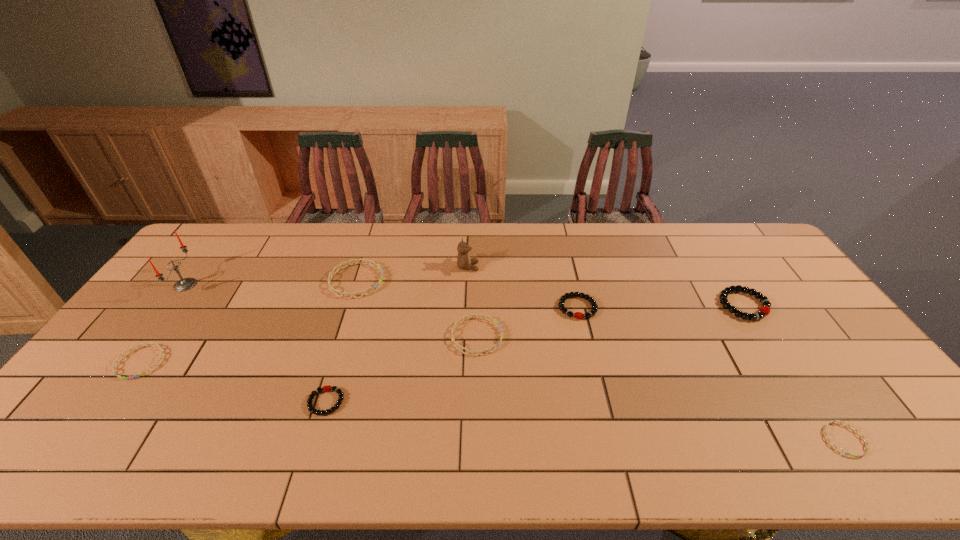
At what (x,y) coordinates should I click in order to perform the action: click on vacant space located on the left of the biggest black bracelet. Please return your answer as a coordinate pair (x, y). This screenshot has width=960, height=540. Looking at the image, I should click on (700, 305).

Where is `free spot located 0.060m on the surface of the second biggest blue bracelet showing star-shaped elements`? The width and height of the screenshot is (960, 540). free spot located 0.060m on the surface of the second biggest blue bracelet showing star-shaped elements is located at coordinates (523, 336).

Locate an element on the screen. free space located on the back of the fifth bracelet from left to right is located at coordinates (561, 235).

Find the location of `free location located on the surface of the leftmost blue bracelet showing star-shaped elements`. free location located on the surface of the leftmost blue bracelet showing star-shaped elements is located at coordinates (65, 467).

This screenshot has width=960, height=540. Identify the location of vacant space located 0.060m on the left of the smallest black bracelet. (284, 402).

You are a GUI agent. You are given a task and a screenshot of the screen. Output one action in this format:
    pyautogui.click(x=<x>, y=<y>)
    Task: Click on the teddy bear at the far edge
    The height and width of the screenshot is (540, 960).
    Given the screenshot: What is the action you would take?
    click(x=464, y=262)

Where is `bracelet present at the far edge`? The width and height of the screenshot is (960, 540). bracelet present at the far edge is located at coordinates (357, 261).

Where is `object that is at the near edge`? object that is at the near edge is located at coordinates (825, 433).

This screenshot has width=960, height=540. I want to click on candle that is at the left edge, so click(x=185, y=284).

Where is `bracelet situated at the left edge`? The height and width of the screenshot is (540, 960). bracelet situated at the left edge is located at coordinates (116, 362).